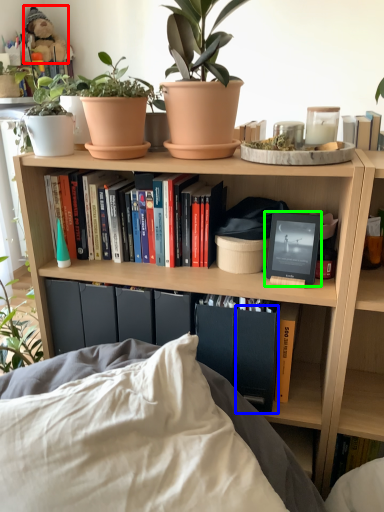
Question: Based on their relative distances, which object is farther from toy (highlighted by a red box)? Choose from paperback book (highlighted by a blue box) and picture frame (highlighted by a green box).

Choices:
 (A) paperback book
 (B) picture frame

Answer: (A)